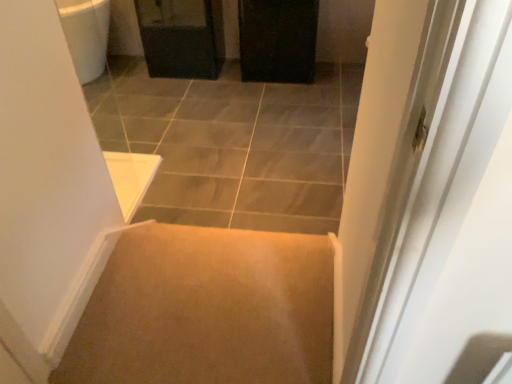
Question: Does carpet at center have a greater width compared to black matte cabinet at upper center?

Choices:
 (A) yes
 (B) no

Answer: (A)

Question: Can we say carpet at center lies outside black matte cabinet at upper center?

Choices:
 (A) no
 (B) yes

Answer: (B)

Question: Is carpet at center at the right side of black matte cabinet at upper center?

Choices:
 (A) no
 (B) yes

Answer: (A)

Question: Is carpet at center positioned before black matte cabinet at upper center?

Choices:
 (A) yes
 (B) no

Answer: (A)

Question: Can you confirm if carpet at center is bigger than black matte cabinet at upper center?

Choices:
 (A) no
 (B) yes

Answer: (B)

Question: Is matte black cabinet at upper center inside or outside of black matte cabinet at upper center?

Choices:
 (A) outside
 (B) inside

Answer: (A)

Question: In the image, is matte black cabinet at upper center on the left side or the right side of black matte cabinet at upper center?

Choices:
 (A) left
 (B) right

Answer: (A)

Question: From their relative heights in the image, would you say matte black cabinet at upper center is taller or shorter than black matte cabinet at upper center?

Choices:
 (A) tall
 (B) short

Answer: (B)

Question: From the image's perspective, relative to black matte cabinet at upper center, is matte black cabinet at upper center above or below?

Choices:
 (A) above
 (B) below

Answer: (A)

Question: From their relative heights in the image, would you say carpet at center is taller or shorter than black matte cabinet at upper center?

Choices:
 (A) short
 (B) tall

Answer: (A)

Question: Relative to black matte cabinet at upper center, is carpet at center in front or behind?

Choices:
 (A) front
 (B) behind

Answer: (A)

Question: Is carpet at center to the left or to the right of black matte cabinet at upper center in the image?

Choices:
 (A) right
 (B) left

Answer: (B)

Question: From a real-world perspective, relative to black matte cabinet at upper center, is carpet at center vertically above or below?

Choices:
 (A) above
 (B) below

Answer: (B)

Question: Would you say matte black cabinet at upper center is inside or outside carpet at center?

Choices:
 (A) outside
 (B) inside

Answer: (A)

Question: Considering the positions of matte black cabinet at upper center and carpet at center in the image, is matte black cabinet at upper center wider or thinner than carpet at center?

Choices:
 (A) wide
 (B) thin

Answer: (B)